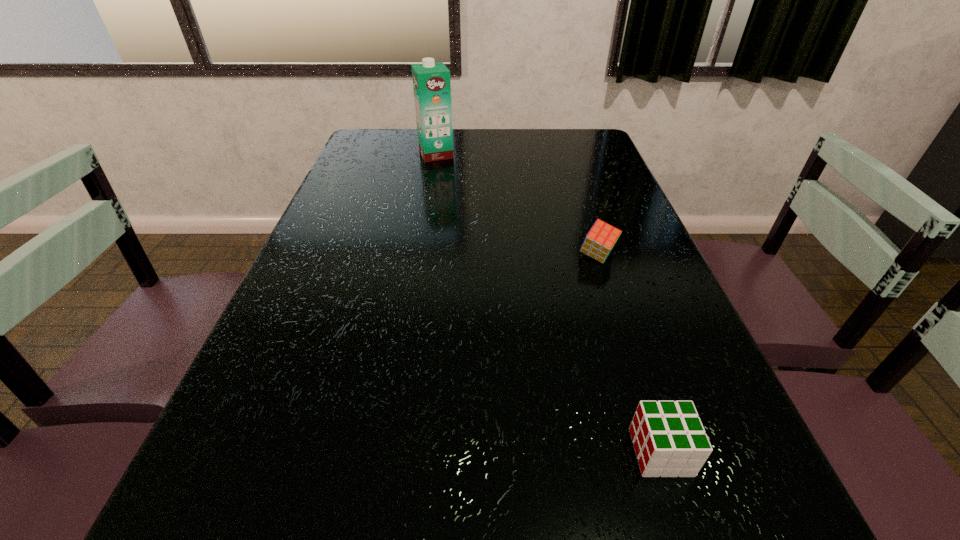
The height and width of the screenshot is (540, 960). I want to click on free area in between the farther cube and the farthest object, so click(x=516, y=205).

Identify the location of empty location between the second nearest object and the farthest object. The height and width of the screenshot is (540, 960). 516,205.

At what (x,y) coordinates should I click in order to perform the action: click on free point between the second nearest object and the farthest object. Please return your answer as a coordinate pair (x, y). Looking at the image, I should click on (516, 205).

Locate an element on the screen. The width and height of the screenshot is (960, 540). free point between the nearer cube and the farthest object is located at coordinates (548, 303).

This screenshot has height=540, width=960. Find the location of `vacant space that is in between the tallest object and the farther cube`. vacant space that is in between the tallest object and the farther cube is located at coordinates (516, 205).

At what (x,y) coordinates should I click in order to perform the action: click on object that is the closest to the farther cube. Please return your answer as a coordinate pair (x, y). Looking at the image, I should click on tap(669, 439).

Point out which object is positioned as the nearest to the farther cube. Please provide its 2D coordinates. Your answer should be formatted as a tuple, i.e. [(x, y)], where the tuple contains the x and y coordinates of a point satisfying the conditions above.

[(669, 439)]

Identify the location of vacant space that satisfies the following two spatial constraints: 1. on the front side of the second nearest object; 2. on the red face of the nearest object. (660, 452).

Identify the location of vacant area in the image that satisfies the following two spatial constraints: 1. on the front side of the second farthest object; 2. on the red face of the nearest object. The height and width of the screenshot is (540, 960). (660, 452).

Locate an element on the screen. vacant area in the image that satisfies the following two spatial constraints: 1. on the front side of the second nearest object; 2. on the red face of the nearest object is located at coordinates (660, 452).